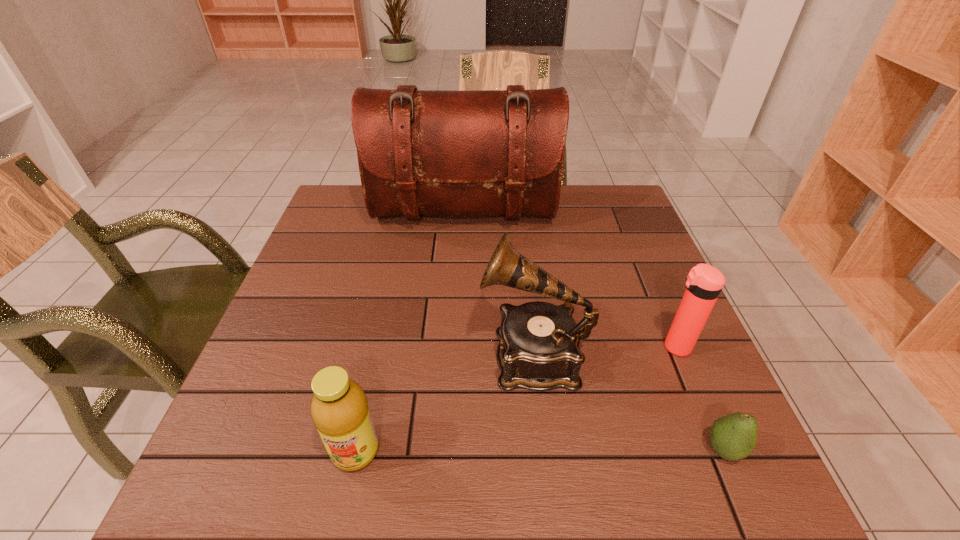
At what (x,y) coordinates should I click in order to perform the action: click on blank space located 0.070m on the left of the thermos bottle. Please return your answer as a coordinate pair (x, y). The image size is (960, 540). Looking at the image, I should click on (627, 347).

Image resolution: width=960 pixels, height=540 pixels. I want to click on vacant space located 0.050m on the front label of the fruit juice, so click(x=344, y=507).

The height and width of the screenshot is (540, 960). I want to click on vacant space located on the back of the shortest object, so click(x=703, y=402).

I want to click on object at the far edge, so click(420, 152).

I want to click on fruit juice situated at the near edge, so click(339, 409).

Locate an element on the screen. The image size is (960, 540). avocado located in the near edge section of the desktop is located at coordinates [x=733, y=437].

At what (x,y) coordinates should I click in order to perform the action: click on object that is positioned at the left edge. Please return your answer as a coordinate pair (x, y). Looking at the image, I should click on (420, 152).

Find the location of `thermos bottle located in the right edge section of the desktop`. thermos bottle located in the right edge section of the desktop is located at coordinates (704, 282).

Locate an element on the screen. This screenshot has width=960, height=540. avocado positioned at the right edge is located at coordinates (733, 437).

Locate an element on the screen. This screenshot has height=540, width=960. object that is at the far left corner is located at coordinates (420, 152).